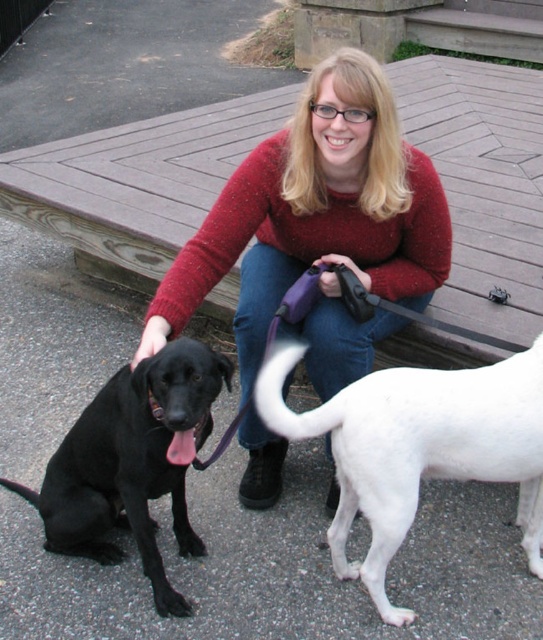
Is red sweater at center shorter than black smooth fur dog at left?

No.

Does point (425, 195) come in front of point (70, 516)?

No, (425, 195) is behind (70, 516).

Locate an element on the screen. This screenshot has width=543, height=640. red sweater at center is located at coordinates (315, 212).

From the picture: Is white smooth dog at lower right to the left of black smooth fur dog at left from the viewer's perspective?

Incorrect, white smooth dog at lower right is not on the left side of black smooth fur dog at left.

Who is more forward, (528, 556) or (74, 493)?

Point (74, 493) is in front.

Which is in front, point (483, 404) or point (150, 397)?

Point (150, 397)

Find the location of `white smooth dog at lower right`. white smooth dog at lower right is located at coordinates (418, 448).

Can you confirm if red sweater at center is wider than white smooth dog at lower right?

Correct, the width of red sweater at center exceeds that of white smooth dog at lower right.

Is red sweater at center below white smooth dog at lower right?

No, red sweater at center is not below white smooth dog at lower right.

Does point (251, 355) come behind point (522, 435)?

Yes, point (251, 355) is farther from viewer.

Find the location of a particular element. The width and height of the screenshot is (543, 640). red sweater at center is located at coordinates (315, 212).